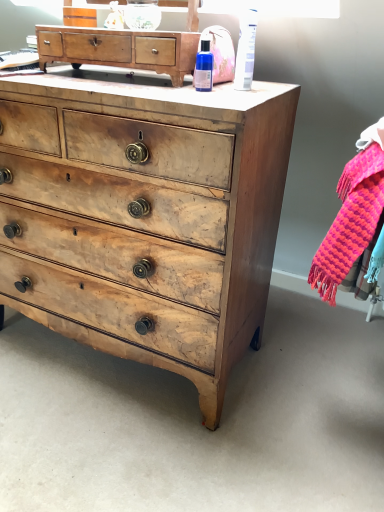
Question: Is wooden chest of drawers at center, the 1th chest of drawers when ordered from bottom to top, shorter than white plastic tube at upper right, the first toiletry positioned from the right?

Choices:
 (A) yes
 (B) no

Answer: (B)

Question: From the image's perspective, is wooden chest of drawers at center, which is the 2th chest of drawers from top to bottom, beneath white plastic tube at upper right, the first toiletry positioned from the right?

Choices:
 (A) yes
 (B) no

Answer: (A)

Question: From a real-world perspective, is wooden chest of drawers at center, which is the 2th chest of drawers from top to bottom, over white plastic tube at upper right, arranged as the 2th toiletry when viewed from the left?

Choices:
 (A) no
 (B) yes

Answer: (A)

Question: From a real-world perspective, is wooden chest of drawers at center, which is the 2th chest of drawers from top to bottom, below white plastic tube at upper right, the first toiletry positioned from the right?

Choices:
 (A) yes
 (B) no

Answer: (A)

Question: Does wooden chest of drawers at center, the 1th chest of drawers when ordered from bottom to top, lie in front of white plastic tube at upper right, arranged as the 2th toiletry when viewed from the left?

Choices:
 (A) no
 (B) yes

Answer: (B)

Question: Visually, is wooden chest of drawers at upper center, which is counted as the first chest of drawers, starting from the top, positioned to the left or to the right of wooden chest of drawers at center, the 1th chest of drawers when ordered from bottom to top?

Choices:
 (A) right
 (B) left

Answer: (A)

Question: Considering the positions of wooden chest of drawers at upper center, which is counted as the first chest of drawers, starting from the top, and wooden chest of drawers at center, which is the 2th chest of drawers from top to bottom, in the image, is wooden chest of drawers at upper center, which is counted as the first chest of drawers, starting from the top, taller or shorter than wooden chest of drawers at center, which is the 2th chest of drawers from top to bottom,?

Choices:
 (A) short
 (B) tall

Answer: (A)

Question: Is wooden chest of drawers at upper center, the second chest of drawers from the bottom, inside the boundaries of wooden chest of drawers at center, which is the 2th chest of drawers from top to bottom, or outside?

Choices:
 (A) outside
 (B) inside

Answer: (A)

Question: From a real-world perspective, is wooden chest of drawers at upper center, the second chest of drawers from the bottom, physically located above or below wooden chest of drawers at center, which is the 2th chest of drawers from top to bottom?

Choices:
 (A) above
 (B) below

Answer: (A)

Question: Is wooden chest of drawers at upper center, the second chest of drawers from the bottom, bigger or smaller than blue glass bottle at upper center, which ranks as the 1th toiletry in left-to-right order?

Choices:
 (A) big
 (B) small

Answer: (A)

Question: From the image's perspective, relative to blue glass bottle at upper center, which ranks as the 1th toiletry in left-to-right order, is wooden chest of drawers at upper center, the second chest of drawers from the bottom, above or below?

Choices:
 (A) above
 (B) below

Answer: (A)

Question: Based on their positions, is wooden chest of drawers at upper center, which is counted as the first chest of drawers, starting from the top, located to the left or right of blue glass bottle at upper center, which ranks as the 1th toiletry in left-to-right order?

Choices:
 (A) left
 (B) right

Answer: (A)

Question: Considering the positions of wooden chest of drawers at upper center, the second chest of drawers from the bottom, and blue glass bottle at upper center, which ranks as the 1th toiletry in left-to-right order, in the image, is wooden chest of drawers at upper center, the second chest of drawers from the bottom, taller or shorter than blue glass bottle at upper center, which ranks as the 1th toiletry in left-to-right order,?

Choices:
 (A) tall
 (B) short

Answer: (A)

Question: In terms of width, does knitted wool scarf at right look wider or thinner when compared to wooden chest of drawers at upper center, the second chest of drawers from the bottom?

Choices:
 (A) wide
 (B) thin

Answer: (A)

Question: In the image, is knitted wool scarf at right positioned in front of or behind wooden chest of drawers at upper center, the second chest of drawers from the bottom?

Choices:
 (A) behind
 (B) front

Answer: (B)